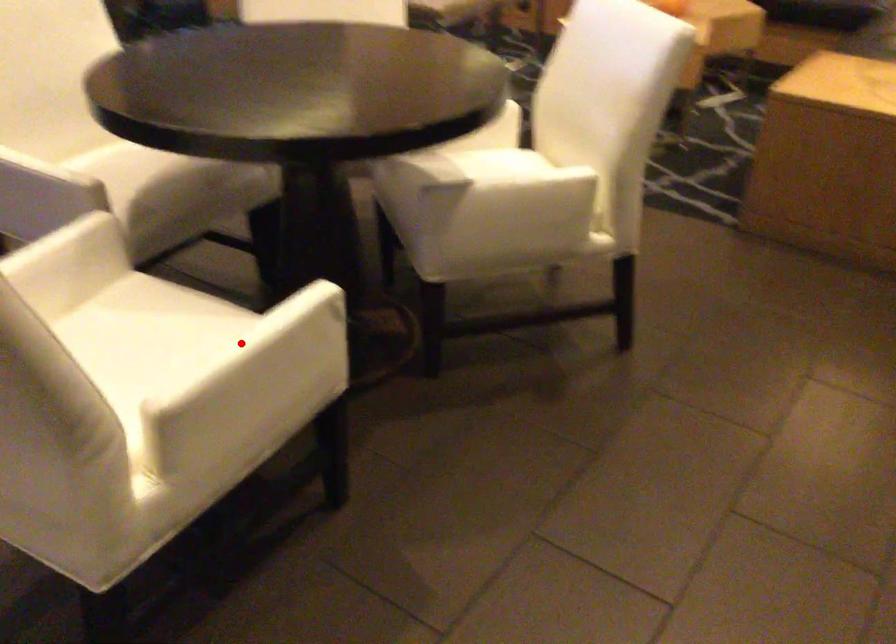
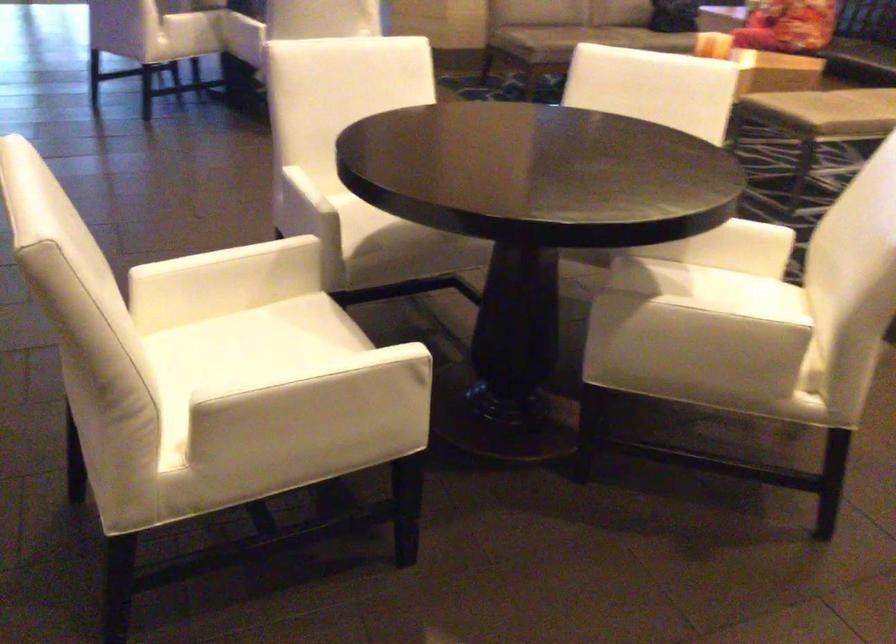
The point at the highlighted location is marked in the first image. Where is the corresponding point in the second image?

(300, 373)